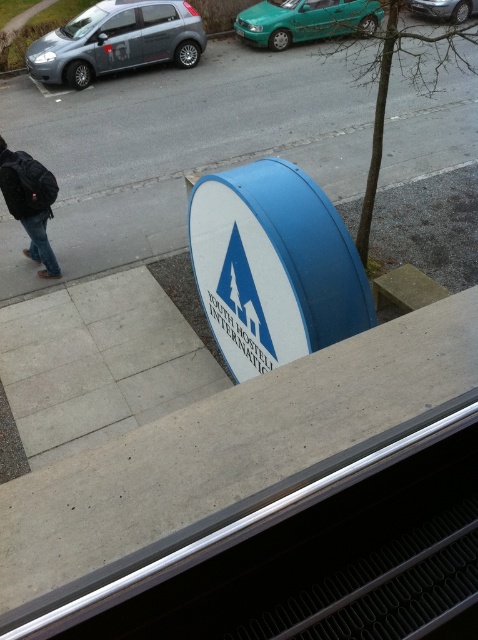
Between teal glossy car at upper center and black backpack at left, which one is positioned higher?

teal glossy car at upper center is above.

Which is in front, point (341, 12) or point (0, 152)?

Point (0, 152) is more forward.

Find the location of a particular element. The width and height of the screenshot is (478, 640). teal glossy car at upper center is located at coordinates (305, 20).

Where is `teal glossy car at upper center`? teal glossy car at upper center is located at coordinates (305, 20).

Between point (197, 33) and point (271, 20), which one is positioned behind?

The point (271, 20) is behind.

Is matte gray hatchback at upper left further to camera compared to teal glossy car at upper center?

That is False.

Identify the location of matte gray hatchback at upper left. (117, 40).

At what (x,y) coordinates should I click in order to perform the action: click on matte gray hatchback at upper left. Please return your answer as a coordinate pair (x, y). This screenshot has width=478, height=640. Looking at the image, I should click on (117, 40).

The width and height of the screenshot is (478, 640). Describe the element at coordinates (117, 40) in the screenshot. I see `matte gray hatchback at upper left` at that location.

Is point (104, 29) farther from camera compared to point (13, 150)?

Yes.

What are the coordinates of `matte gray hatchback at upper left` in the screenshot? It's located at (117, 40).